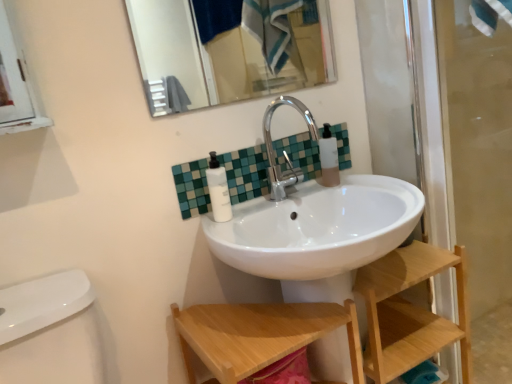
Describe the element at coordinates (218, 190) in the screenshot. The height and width of the screenshot is (384, 512). I see `white matte pump bottle at center, positioned as the 2th toiletry in right-to-left order` at that location.

Describe the element at coordinates (329, 158) in the screenshot. This screenshot has height=384, width=512. I see `translucent plastic bottle at upper right, which is counted as the 1th toiletry, starting from the back` at that location.

At what (x,y) coordinates should I click in order to perform the action: click on green mosaic tile at center. Please return your answer as a coordinate pair (x, y). Image resolution: width=512 pixels, height=384 pixels. Looking at the image, I should click on (246, 173).

Are transparent glass screen door at right and wooden shelf at lower right located far from each other?

No, there isn't a large distance between transparent glass screen door at right and wooden shelf at lower right.

From a real-world perspective, which is physically below, transparent glass screen door at right or wooden shelf at lower right?

wooden shelf at lower right, from a real-world perspective.

Does transparent glass screen door at right have a lesser width compared to wooden shelf at lower right?

Yes, transparent glass screen door at right is thinner than wooden shelf at lower right.

From the image's perspective, which one is positioned higher, transparent glass screen door at right or wooden shelf at lower right?

transparent glass screen door at right, from the image's perspective.

Considering the positions of objects translucent plastic bottle at upper right, placed as the first toiletry when sorted from right to left, and green mosaic tile at center in the image provided, who is behind, translucent plastic bottle at upper right, placed as the first toiletry when sorted from right to left, or green mosaic tile at center?

translucent plastic bottle at upper right, placed as the first toiletry when sorted from right to left, is behind.

You are a GUI agent. You are given a task and a screenshot of the screen. Output one action in this format:
    pyautogui.click(x=<x>, y=<y>)
    Task: Click on the tile in front of the translucent plastic bottle at upper right, the second toiletry when ordered from front to back
    
    Given the screenshot: What is the action you would take?
    pyautogui.click(x=246, y=173)

Which is in front, point (325, 142) or point (301, 156)?

The point (325, 142) is in front.

Is wooden step stool at lower center not close to translucent plastic bottle at upper right, placed as the first toiletry when sorted from right to left?

No, wooden step stool at lower center is not far away from translucent plastic bottle at upper right, placed as the first toiletry when sorted from right to left.

Considering the relative sizes of wooden step stool at lower center and translucent plastic bottle at upper right, the second toiletry when ordered from front to back, in the image provided, is wooden step stool at lower center bigger than translucent plastic bottle at upper right, the second toiletry when ordered from front to back,?

Indeed, wooden step stool at lower center has a larger size compared to translucent plastic bottle at upper right, the second toiletry when ordered from front to back.

Is wooden step stool at lower center not inside translucent plastic bottle at upper right, placed as the first toiletry when sorted from right to left?

Yes, wooden step stool at lower center is located beyond the bounds of translucent plastic bottle at upper right, placed as the first toiletry when sorted from right to left.

Could you tell me if wooden step stool at lower center is facing translucent plastic bottle at upper right, the second toiletry when ordered from front to back?

No, wooden step stool at lower center does not turn towards translucent plastic bottle at upper right, the second toiletry when ordered from front to back.

Is the surface of wooden shelf at lower right in direct contact with metallic silver mirror at upper center?

No, wooden shelf at lower right is not with metallic silver mirror at upper center.

Can you confirm if wooden shelf at lower right is wider than metallic silver mirror at upper center?

Yes.

Is metallic silver mirror at upper center surrounded by wooden shelf at lower right?

No, metallic silver mirror at upper center is located outside of wooden shelf at lower right.

In the image, is wooden shelf at lower right positioned in front of or behind metallic silver mirror at upper center?

Visually, wooden shelf at lower right is located in front of metallic silver mirror at upper center.

From a real-world perspective, is green mosaic tile at center over white matte pump bottle at center, which ranks as the first toiletry in left-to-right order?

No, from a real-world perspective, green mosaic tile at center is not above white matte pump bottle at center, which ranks as the first toiletry in left-to-right order.

How different are the orientations of green mosaic tile at center and white matte pump bottle at center, positioned as the 2th toiletry in right-to-left order, in degrees?

The angle between the facing direction of green mosaic tile at center and the facing direction of white matte pump bottle at center, positioned as the 2th toiletry in right-to-left order, is 0.000788 degrees.

Measure the distance from green mosaic tile at center to white matte pump bottle at center, positioned as the 2th toiletry in right-to-left order.

green mosaic tile at center and white matte pump bottle at center, positioned as the 2th toiletry in right-to-left order, are 5.37 inches apart.

Would you say green mosaic tile at center contains white matte pump bottle at center, positioned as the 2th toiletry in right-to-left order?

No.

Who is smaller, wooden step stool at lower center or white matte pump bottle at center, which appears as the 1th toiletry when viewed from the front?

Smaller between the two is white matte pump bottle at center, which appears as the 1th toiletry when viewed from the front.

Can you confirm if wooden step stool at lower center is thinner than white matte pump bottle at center, which appears as the 1th toiletry when viewed from the front?

Incorrect, the width of wooden step stool at lower center is not less than that of white matte pump bottle at center, which appears as the 1th toiletry when viewed from the front.

Where is `step stool below the white matte pump bottle at center, which ranks as the first toiletry in left-to-right order (from a real-world perspective)`? Image resolution: width=512 pixels, height=384 pixels. step stool below the white matte pump bottle at center, which ranks as the first toiletry in left-to-right order (from a real-world perspective) is located at coordinates (259, 335).

Between wooden step stool at lower center and white matte pump bottle at center, which appears as the 1th toiletry when viewed from the front, which one is positioned in front?

wooden step stool at lower center is closer to the camera.

Could you tell me if green mosaic tile at center is facing wooden step stool at lower center?

No, green mosaic tile at center is not aimed at wooden step stool at lower center.

From the image's perspective, is green mosaic tile at center under wooden step stool at lower center?

Incorrect, from the image's perspective, green mosaic tile at center is higher than wooden step stool at lower center.

Which of these two, green mosaic tile at center or wooden step stool at lower center, stands taller?

With more height is wooden step stool at lower center.

Considering the sizes of green mosaic tile at center and wooden step stool at lower center in the image, is green mosaic tile at center wider or thinner than wooden step stool at lower center?

In the image, green mosaic tile at center appears to be more narrow than wooden step stool at lower center.

In the image, there is a transparent glass screen door at right. Find the location of `shelf below it (from the image's perspective)`. shelf below it (from the image's perspective) is located at coordinates (410, 311).

You are a GUI agent. You are given a task and a screenshot of the screen. Output one action in this format:
    pyautogui.click(x=<x>, y=<y>)
    Task: Click on the toiletry on the right side of green mosaic tile at center
    This screenshot has height=384, width=512.
    Given the screenshot: What is the action you would take?
    pyautogui.click(x=329, y=158)

Which object lies further to the anchor point wooden step stool at lower center, wooden shelf at lower right or green mosaic tile at center?

green mosaic tile at center.

Considering their positions, is white matte pump bottle at center, positioned as the 2th toiletry in right-to-left order, positioned further to metallic silver mirror at upper center than wooden shelf at lower right?

white matte pump bottle at center, positioned as the 2th toiletry in right-to-left order, is further to metallic silver mirror at upper center.

From the image, which object appears to be farther from transparent glass screen door at right, translucent plastic bottle at upper right, which is counted as the 2th toiletry, starting from the left, or white matte pump bottle at center, which ranks as the first toiletry in left-to-right order?

The object further to transparent glass screen door at right is white matte pump bottle at center, which ranks as the first toiletry in left-to-right order.

From the image, which object appears to be farther from transparent glass screen door at right, green mosaic tile at center or wooden step stool at lower center?

wooden step stool at lower center.

Based on their spatial positions, is translucent plastic bottle at upper right, which is counted as the 1th toiletry, starting from the back, or transparent glass screen door at right closer to metallic silver mirror at upper center?

transparent glass screen door at right lies closer to metallic silver mirror at upper center than the other object.

Considering their positions, is transparent glass screen door at right positioned closer to wooden shelf at lower right than translucent plastic bottle at upper right, placed as the first toiletry when sorted from right to left?

translucent plastic bottle at upper right, placed as the first toiletry when sorted from right to left, is closer to wooden shelf at lower right.

From the image, which object appears to be farther from silver metallic faucet at center, wooden shelf at lower right or wooden step stool at lower center?

wooden shelf at lower right is positioned further to the anchor silver metallic faucet at center.

In the scene shown: Looking at the image, which one is located further to transparent glass screen door at right, wooden step stool at lower center or metallic silver mirror at upper center?

metallic silver mirror at upper center is further to transparent glass screen door at right.

Find the location of a particular element. The height and width of the screenshot is (384, 512). tap between metallic silver mirror at upper center and transparent glass screen door at right is located at coordinates (273, 149).

At what (x,y) coordinates should I click in order to perform the action: click on screen door between metallic silver mirror at upper center and wooden step stool at lower center in the vertical direction. Please return your answer as a coordinate pair (x, y). Image resolution: width=512 pixels, height=384 pixels. Looking at the image, I should click on (478, 146).

Identify the location of shelf between white matte pump bottle at center, which appears as the 1th toiletry when viewed from the front, and transparent glass screen door at right from left to right. (410, 311).

Locate an element on the screen. This screenshot has height=384, width=512. tap between translucent plastic bottle at upper right, which is counted as the 1th toiletry, starting from the back, and wooden shelf at lower right, in the vertical direction is located at coordinates (273, 149).